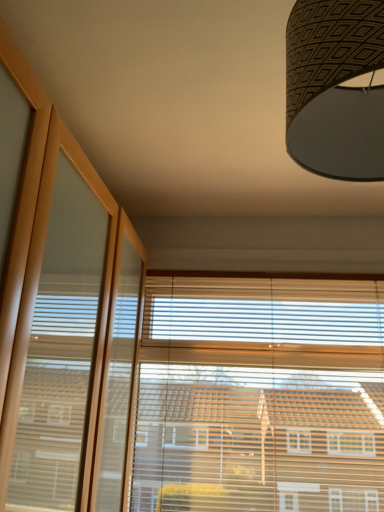
In order to face textured brown lampshade at upper right, should I rotate leftwards or rightwards?

Rotate your view right by about 20.190°.

The image size is (384, 512). What do you see at coordinates (335, 88) in the screenshot? I see `textured brown lampshade at upper right` at bounding box center [335, 88].

Find the location of a particular element. textured brown lampshade at upper right is located at coordinates (335, 88).

The height and width of the screenshot is (512, 384). In order to click on wooden blinds at center in this screenshot , I will do `click(260, 395)`.

What is the approximate height of wooden blinds at center?

It is 95.95 centimeters.

In order to face wooden blinds at center, should I rotate leftwards or rightwards?

Rotate right and turn 9.233 degrees.

Image resolution: width=384 pixels, height=512 pixels. Describe the element at coordinates (260, 395) in the screenshot. I see `wooden blinds at center` at that location.

Locate an element on the screen. textured brown lampshade at upper right is located at coordinates (335, 88).

In the image, is textured brown lampshade at upper right on the left side or the right side of wooden blinds at center?

Clearly, textured brown lampshade at upper right is on the left of wooden blinds at center in the image.

Considering their positions, is textured brown lampshade at upper right located in front of or behind wooden blinds at center?

textured brown lampshade at upper right is positioned closer to the viewer than wooden blinds at center.

Considering the positions of points (335, 33) and (321, 302), is point (335, 33) closer to camera compared to point (321, 302)?

Yes.

From the image's perspective, is textured brown lampshade at upper right above wooden blinds at center?

Correct, textured brown lampshade at upper right appears higher than wooden blinds at center in the image.

From a real-world perspective, is textured brown lampshade at upper right physically located above or below wooden blinds at center?

Clearly, from a real-world perspective, textured brown lampshade at upper right is above wooden blinds at center.

Does textured brown lampshade at upper right have a lesser width compared to wooden blinds at center?

No, textured brown lampshade at upper right is not thinner than wooden blinds at center.

Is textured brown lampshade at upper right shorter than wooden blinds at center?

Yes, textured brown lampshade at upper right is shorter than wooden blinds at center.

Between textured brown lampshade at upper right and wooden blinds at center, which one has larger size?

With larger size is wooden blinds at center.

Is wooden blinds at center surrounded by textured brown lampshade at upper right?

No, wooden blinds at center is not a part of textured brown lampshade at upper right.

Is textured brown lampshade at upper right far away from wooden blinds at center?

Indeed, textured brown lampshade at upper right is not near wooden blinds at center.

Could you tell me if textured brown lampshade at upper right is turned towards wooden blinds at center?

No, textured brown lampshade at upper right is not oriented towards wooden blinds at center.

How different are the orientations of textured brown lampshade at upper right and wooden blinds at center in degrees?

The angular difference between textured brown lampshade at upper right and wooden blinds at center is 0.442 degrees.

Locate an element on the screen. The image size is (384, 512). lamp to the left of wooden blinds at center is located at coordinates (335, 88).

In the scene shown: Does wooden blinds at center appear on the right side of textured brown lampshade at upper right?

Yes.

Considering the positions of objects wooden blinds at center and textured brown lampshade at upper right in the image provided, who is in front, wooden blinds at center or textured brown lampshade at upper right?

textured brown lampshade at upper right is closer to the camera.

Does point (176, 487) come closer to viewer compared to point (310, 149)?

No, (176, 487) is behind (310, 149).

From the image's perspective, relative to textured brown lampshade at upper right, is wooden blinds at center above or below?

wooden blinds at center is below textured brown lampshade at upper right.

From a real-world perspective, between wooden blinds at center and textured brown lampshade at upper right, who is vertically lower?

In real-world perspective, wooden blinds at center is lower.

Consider the image. Which object is wider, wooden blinds at center or textured brown lampshade at upper right?

Wider between the two is textured brown lampshade at upper right.

Who is shorter, wooden blinds at center or textured brown lampshade at upper right?

With less height is textured brown lampshade at upper right.

Does wooden blinds at center have a smaller size compared to textured brown lampshade at upper right?

No.

Do you think wooden blinds at center is within textured brown lampshade at upper right, or outside of it?

wooden blinds at center cannot be found inside textured brown lampshade at upper right.

Is there a large distance between wooden blinds at center and textured brown lampshade at upper right?

That's right, there is a large distance between wooden blinds at center and textured brown lampshade at upper right.

Is wooden blinds at center turned away from textured brown lampshade at upper right?

No, wooden blinds at center's orientation is not away from textured brown lampshade at upper right.

You are a GUI agent. You are given a task and a screenshot of the screen. Output one action in this format:
    pyautogui.click(x=<x>, y=<y>)
    Task: Click on the bay window behind the textured brown lampshade at upper right
    
    Given the screenshot: What is the action you would take?
    click(x=260, y=395)

Identify the location of lamp located on the left of wooden blinds at center. The height and width of the screenshot is (512, 384). (335, 88).

This screenshot has height=512, width=384. Identify the location of lamp above the wooden blinds at center (from a real-world perspective). (335, 88).